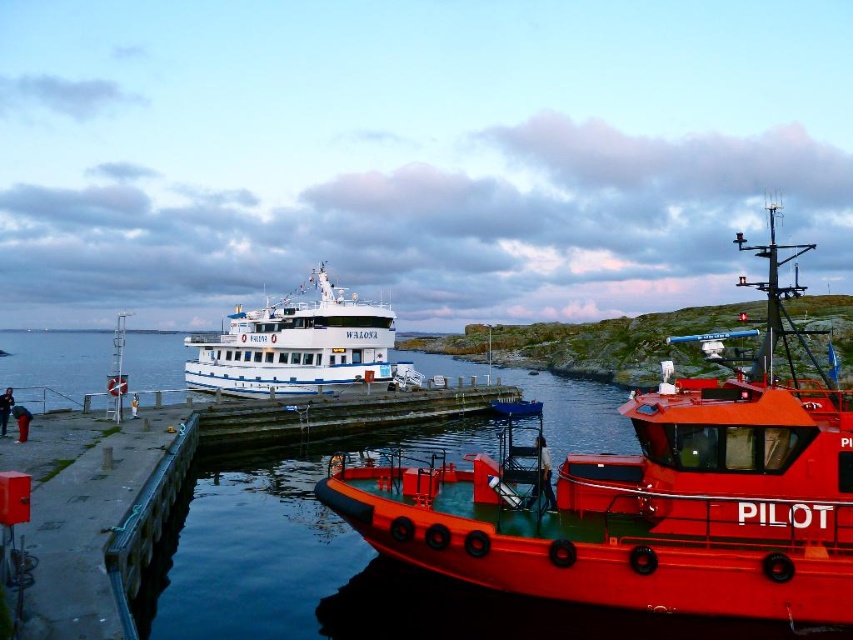
Which of these two, rubberized red pilot boat at right or white matte ferry at center, stands shorter?

With less height is rubberized red pilot boat at right.

Is rubberized red pilot boat at right positioned at the back of white matte ferry at center?

No, it is not.

This screenshot has height=640, width=853. What are the coordinates of `rubberized red pilot boat at right` in the screenshot? It's located at (647, 497).